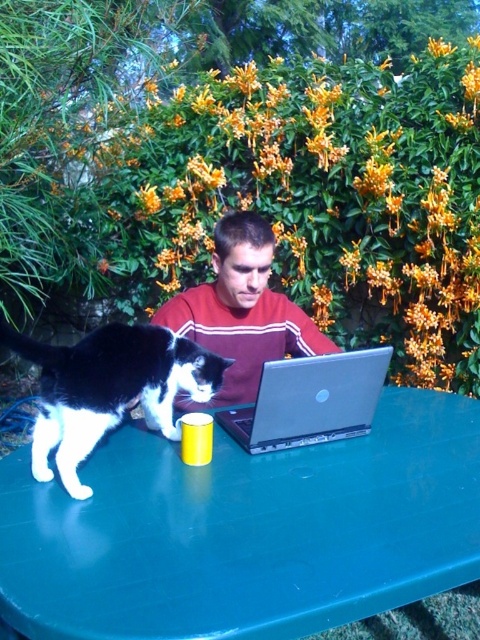
Question: Which object appears closest to the camera in this image?

Choices:
 (A) green plastic table at center
 (B) silver metallic laptop at center

Answer: (A)

Question: Which point is closer to the camera taking this photo?

Choices:
 (A) (303, 381)
 (B) (298, 310)
 (C) (456, 509)

Answer: (C)

Question: Where is green plastic table at center located in relation to black and white fur cat at left in the image?

Choices:
 (A) below
 (B) above

Answer: (A)

Question: Does black and white fur cat at left appear over silver metallic laptop at center?

Choices:
 (A) yes
 (B) no

Answer: (A)

Question: Does maroon sweater at center appear on the right side of silver metallic laptop at center?

Choices:
 (A) no
 (B) yes

Answer: (A)

Question: Which of the following is the farthest from the observer?

Choices:
 (A) maroon sweater at center
 (B) green plastic table at center
 (C) black and white fur cat at left
 (D) silver metallic laptop at center

Answer: (A)